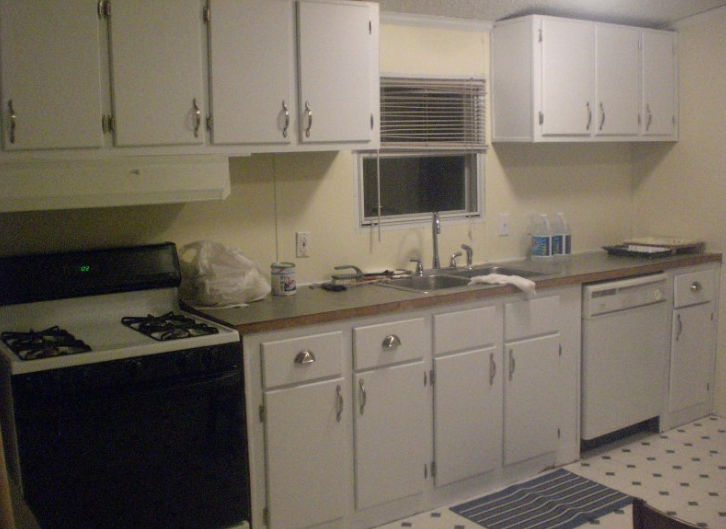
Locate an element on the screen. Image resolution: width=726 pixels, height=529 pixels. rug is located at coordinates (558, 501).